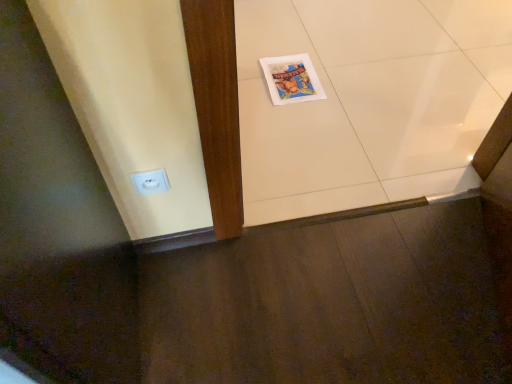
At what (x,y) coordinates should I click in order to perform the action: click on free spot below matte paper comic book at center (from a real-world perspective). Please return your answer as a coordinate pair (x, y). Looking at the image, I should click on (295, 77).